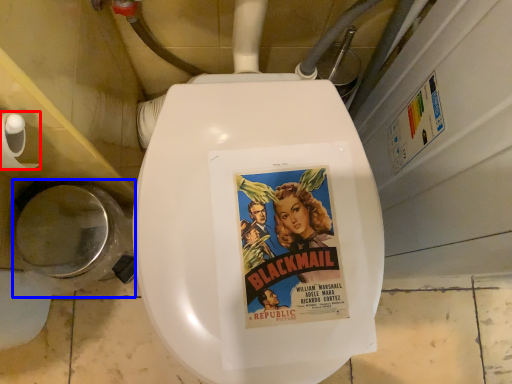
Question: Which object is further to the camera taking this photo, toilet paper (highlighted by a red box) or toilet bowl (highlighted by a blue box)?

Choices:
 (A) toilet paper
 (B) toilet bowl

Answer: (B)